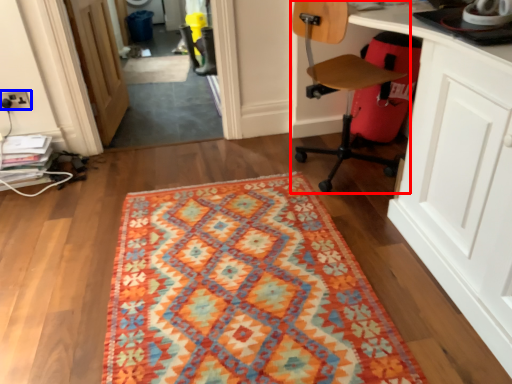
Question: Which of the following is the closest to the observer, chair (highlighted by a red box) or electric outlet (highlighted by a blue box)?

Choices:
 (A) chair
 (B) electric outlet

Answer: (A)